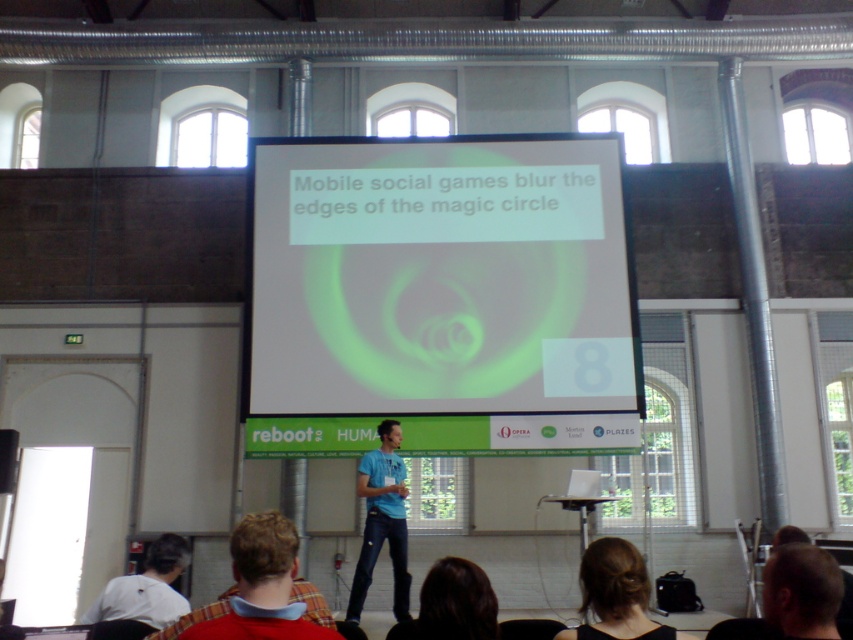
Who is more forward, (352, 310) or (218, 636)?

Point (218, 636) is in front.

Which is more to the right, white matte projection screen at center or plaid shirt at lower center?

white matte projection screen at center

Does point (456, 262) lie behind point (242, 600)?

Yes.

Where is `white matte projection screen at center`? white matte projection screen at center is located at coordinates (440, 296).

Does white matte projection screen at center have a smaller size compared to blue denim jeans at center?

Actually, white matte projection screen at center might be larger than blue denim jeans at center.

Is point (430, 163) positioned behind point (355, 600)?

That is True.

Locate an element on the screen. white matte projection screen at center is located at coordinates (440, 296).

Who is more forward, (363, 248) or (143, 611)?

Positioned in front is point (143, 611).

Is white matte projection screen at center further to camera compared to white matte shirt at lower left?

Yes, it is behind white matte shirt at lower left.

Is point (506, 292) positioned after point (123, 600)?

That is True.

I want to click on white matte projection screen at center, so click(440, 296).